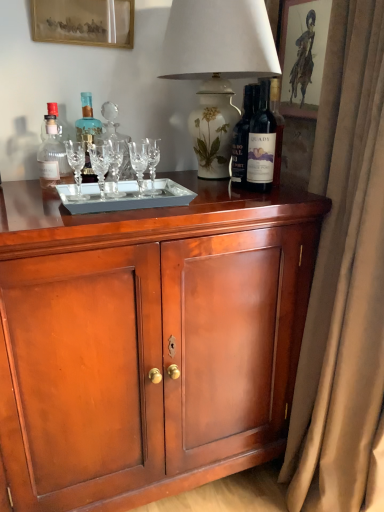
This screenshot has height=512, width=384. I want to click on free spot to the left of matte glass bottle at left, the first bottle from the left, so click(23, 184).